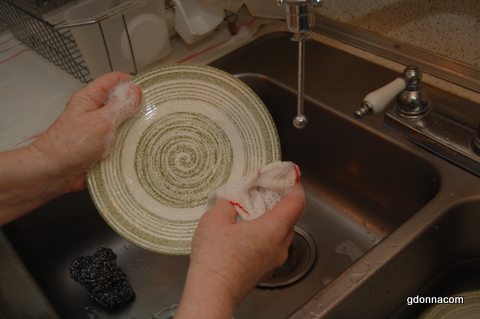
Locate an element on the screen. Image resolution: width=480 pixels, height=319 pixels. dish drying rack is located at coordinates (58, 42).